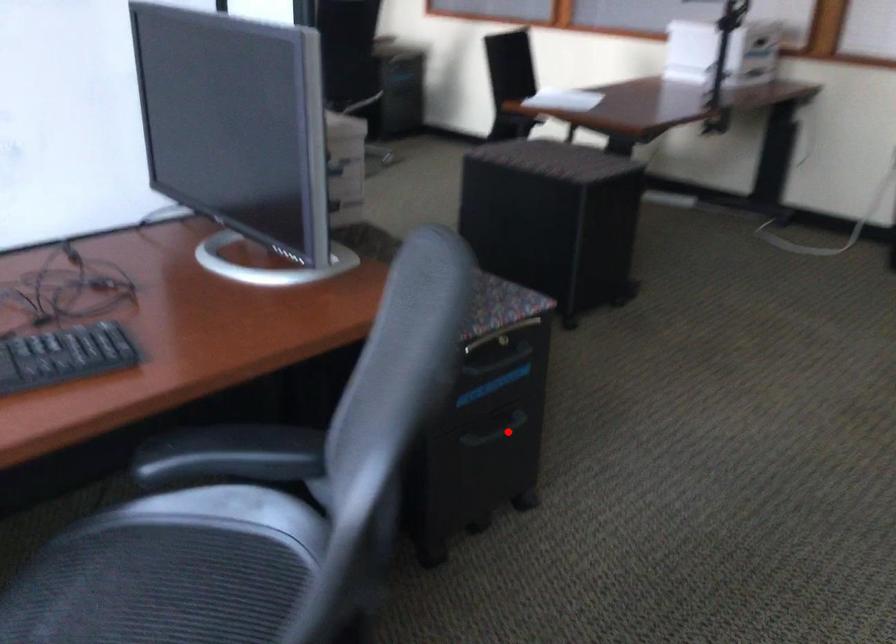
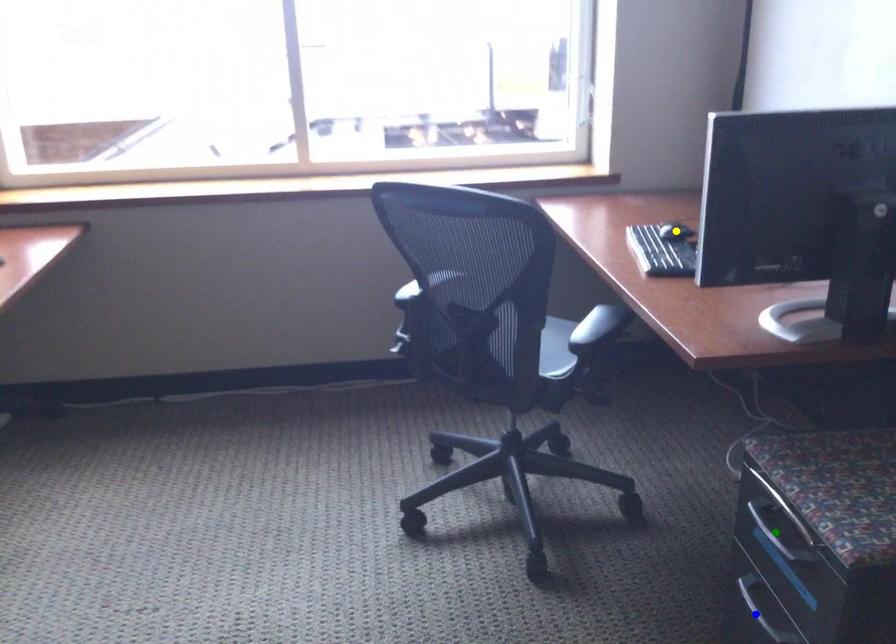
Question: I am providing you with two images of the same scene from different viewpoints. A red point is marked on the first image. You are given multiple points on the second image. Which point in image 2 represents the same 3d spot as the red point in image 1?

Choices:
 (A) green point
 (B) blue point
 (C) yellow point

Answer: (B)